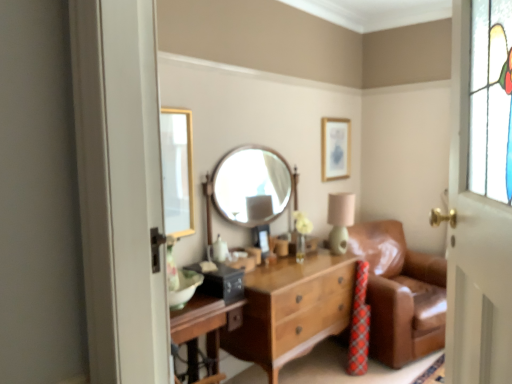
Question: Can we say brown leather couch at right lies outside wooden round mirror at center?

Choices:
 (A) yes
 (B) no

Answer: (A)

Question: Is brown leather couch at right wider than wooden round mirror at center?

Choices:
 (A) yes
 (B) no

Answer: (A)

Question: Can you confirm if brown leather couch at right is bigger than wooden round mirror at center?

Choices:
 (A) yes
 (B) no

Answer: (A)

Question: Could you tell me if brown leather couch at right is facing wooden round mirror at center?

Choices:
 (A) yes
 (B) no

Answer: (B)

Question: From the image's perspective, is brown leather couch at right on top of wooden round mirror at center?

Choices:
 (A) yes
 (B) no

Answer: (B)

Question: Can you confirm if brown leather couch at right is shorter than wooden round mirror at center?

Choices:
 (A) yes
 (B) no

Answer: (B)

Question: Can you confirm if white painted wood door at right is positioned to the right of wooden round mirror at center?

Choices:
 (A) yes
 (B) no

Answer: (A)

Question: Does white painted wood door at right have a greater height compared to wooden round mirror at center?

Choices:
 (A) no
 (B) yes

Answer: (B)

Question: Is white painted wood door at right positioned far away from wooden round mirror at center?

Choices:
 (A) no
 (B) yes

Answer: (B)

Question: Can you confirm if white painted wood door at right is positioned to the left of wooden round mirror at center?

Choices:
 (A) yes
 (B) no

Answer: (B)

Question: Does white painted wood door at right come behind wooden round mirror at center?

Choices:
 (A) yes
 (B) no

Answer: (B)

Question: From the image's perspective, is white painted wood door at right under wooden round mirror at center?

Choices:
 (A) yes
 (B) no

Answer: (A)

Question: From the image's perspective, is wooden round mirror at center above matte green table lamp at center?

Choices:
 (A) yes
 (B) no

Answer: (A)